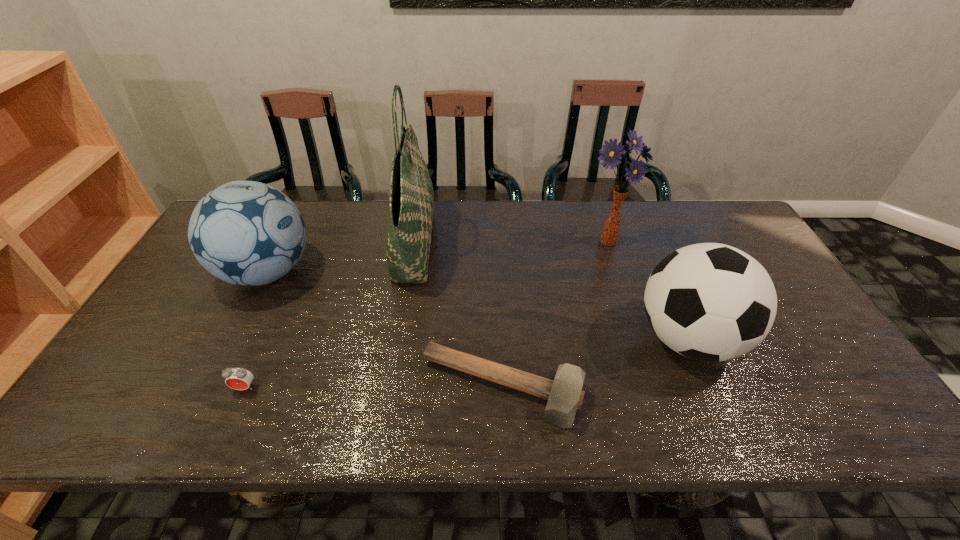
Locate an element on the screen. The height and width of the screenshot is (540, 960). free location located on the side with brand of the left soccer ball is located at coordinates (418, 272).

The image size is (960, 540). Find the location of `vacant space located on the left of the right soccer ball`. vacant space located on the left of the right soccer ball is located at coordinates (492, 339).

This screenshot has width=960, height=540. I want to click on free region located on the left of the third object from right to left, so click(383, 388).

Find the location of a particular element. tote bag that is at the far edge is located at coordinates (411, 191).

Image resolution: width=960 pixels, height=540 pixels. I want to click on flower arrangement that is at the far edge, so click(612, 153).

At what (x,y) coordinates should I click in order to perform the action: click on soccer ball situated at the far edge. Please return your answer as a coordinate pair (x, y). The height and width of the screenshot is (540, 960). Looking at the image, I should click on (247, 233).

Where is `object that is at the near edge`? The image size is (960, 540). object that is at the near edge is located at coordinates (565, 395).

What are the coordinates of `object that is at the left edge` in the screenshot? It's located at (247, 233).

Locate an element on the screen. Image resolution: width=960 pixels, height=540 pixels. object located in the far left corner section of the desktop is located at coordinates (247, 233).

Locate an element on the screen. Image resolution: width=960 pixels, height=540 pixels. free space at the far edge of the desktop is located at coordinates (523, 204).